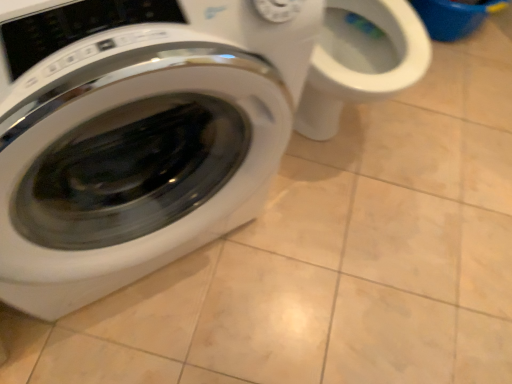
In order to face white glossy washing machine at left, should I rotate leftwards or rightwards?

Turn left approximately 17.127 degrees to face it.

Locate an element on the screen. This screenshot has width=512, height=384. white glossy washing machine at left is located at coordinates (144, 146).

What do you see at coordinates (144, 146) in the screenshot? I see `white glossy washing machine at left` at bounding box center [144, 146].

The height and width of the screenshot is (384, 512). Find the location of `white glossy washing machine at left`. white glossy washing machine at left is located at coordinates click(x=144, y=146).